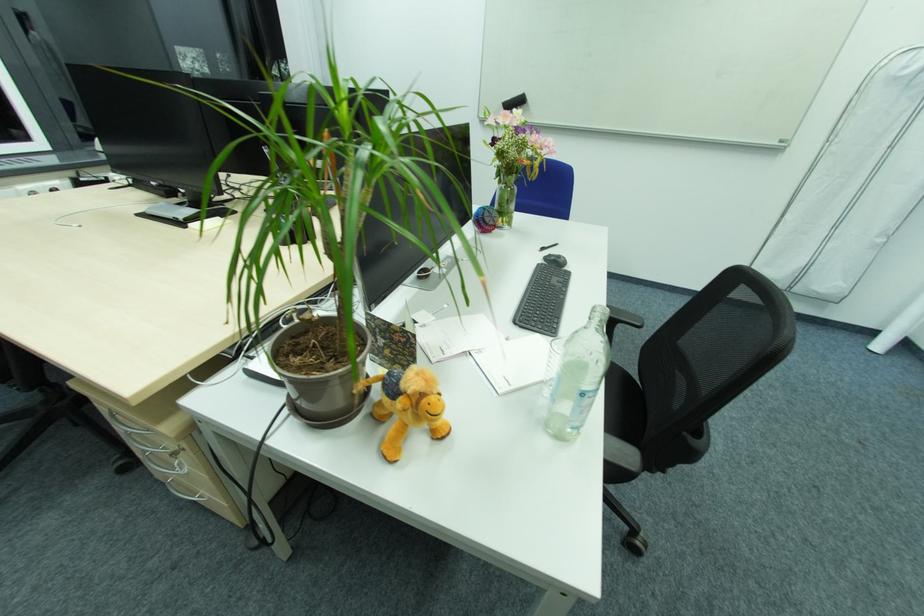
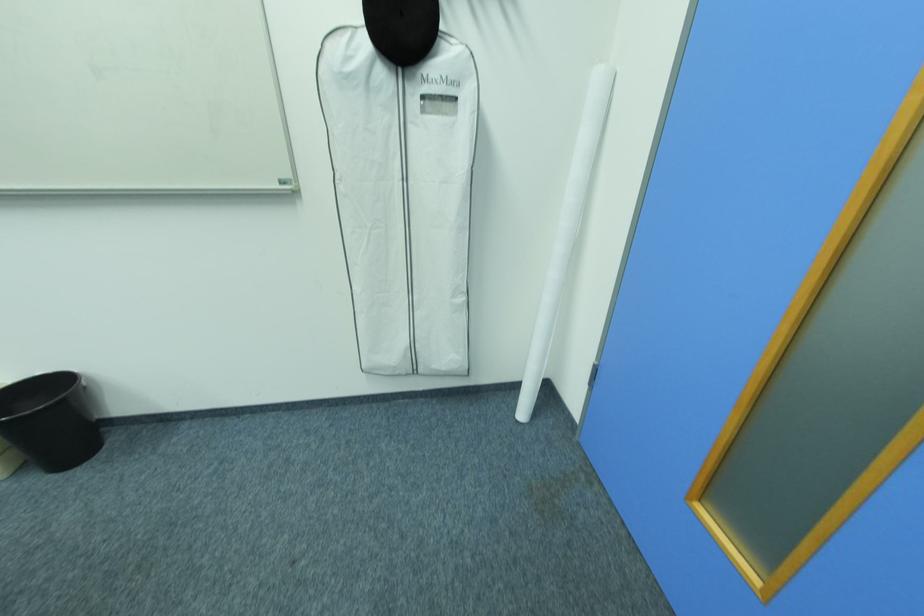
Find the pixel in the second image that matches (841,227) in the first image.

(416, 292)